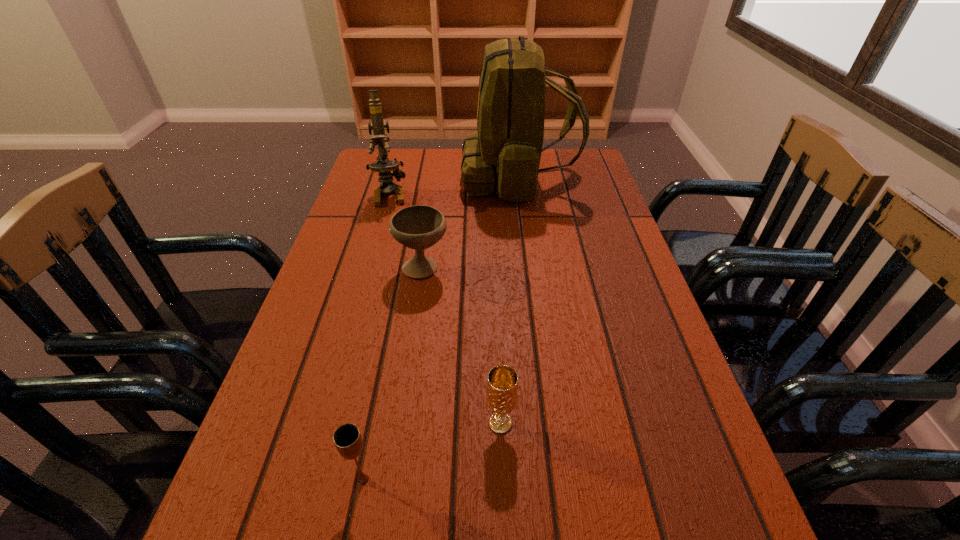
Image resolution: width=960 pixels, height=540 pixels. I want to click on the tallest object, so pos(505,152).

Identify the location of microscope. This screenshot has height=540, width=960. (384, 166).

At what (x,y) coordinates should I click in order to perform the action: click on the second tallest object. Please return your answer as a coordinate pair (x, y). The height and width of the screenshot is (540, 960). Looking at the image, I should click on (384, 166).

Image resolution: width=960 pixels, height=540 pixels. I want to click on the third nearest object, so click(418, 227).

The image size is (960, 540). Identify the location of the nearest chalice. (347, 438).

The image size is (960, 540). Find the location of `the fourth farthest object`. the fourth farthest object is located at coordinates (502, 384).

The width and height of the screenshot is (960, 540). Find the location of `the rightmost chalice`. the rightmost chalice is located at coordinates (502, 384).

Image resolution: width=960 pixels, height=540 pixels. In order to click on free location located on the front-facing side of the tallest object in this screenshot , I will do `click(426, 177)`.

Where is `vacant space situated on the front-facing side of the tallest object`? The width and height of the screenshot is (960, 540). vacant space situated on the front-facing side of the tallest object is located at coordinates (426, 177).

Find the location of a particular element. vacant region located on the front-facing side of the tallest object is located at coordinates (391, 177).